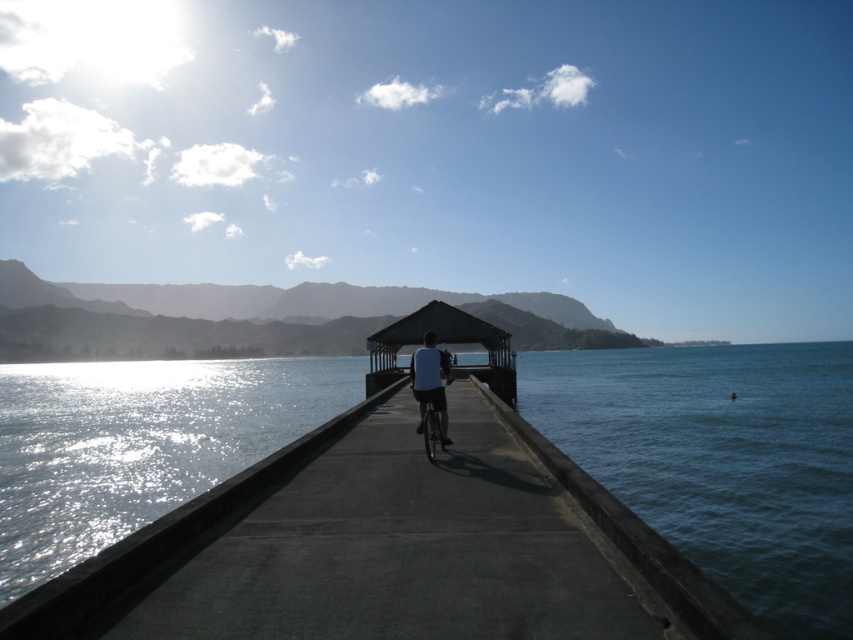
You are standing on the pier and want to take a photo of the blue water at lower right and the matte black shelter at center. Which object should you point your camera towards first if you want to capture both in the same frame without moving the camera?

You should point your camera towards the blue water at lower right first because it is located below the matte black shelter at center, so adjusting the angle to include both would require framing from the lower part upwards.

You are standing on the beach and see the concrete pier at center and the white matte shirt at center. Which object is wider?

The concrete pier at center is wider than the white matte shirt at center.

You are standing on the pier and want to take a photo of the blue water at lower right. Where should you point your camera?

You should point your camera towards the lower right direction, specifically at point coordinates of (x=721, y=461) to capture the blue water at lower right.